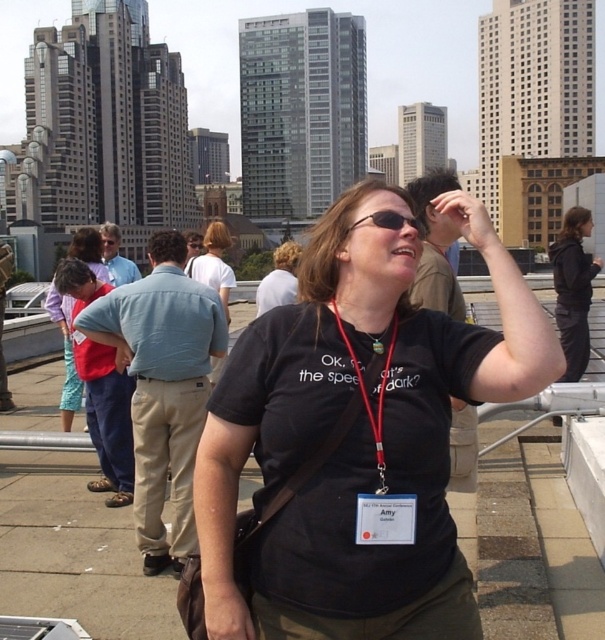
Question: Is matte white shirt at center behind sunglasses at center?

Choices:
 (A) yes
 (B) no

Answer: (A)

Question: Is matte red shirt at left closer to camera compared to sunglasses at center?

Choices:
 (A) yes
 (B) no

Answer: (B)

Question: Which object appears farthest from the camera in this image?

Choices:
 (A) black matte t-shirt at center
 (B) dark gray hoodie at upper right

Answer: (B)

Question: Considering the real-world distances, which object is farthest from the matte red shirt at left?

Choices:
 (A) matte white shirt at center
 (B) black matte t-shirt at center

Answer: (B)

Question: Which point is farther from the camera taking this photo?

Choices:
 (A) (227, 314)
 (B) (413, 220)
 (C) (592, 218)
 (D) (420, 573)

Answer: (C)

Question: Can you confirm if dark gray hoodie at upper right is positioned to the left of matte white shirt at center?

Choices:
 (A) no
 (B) yes

Answer: (A)